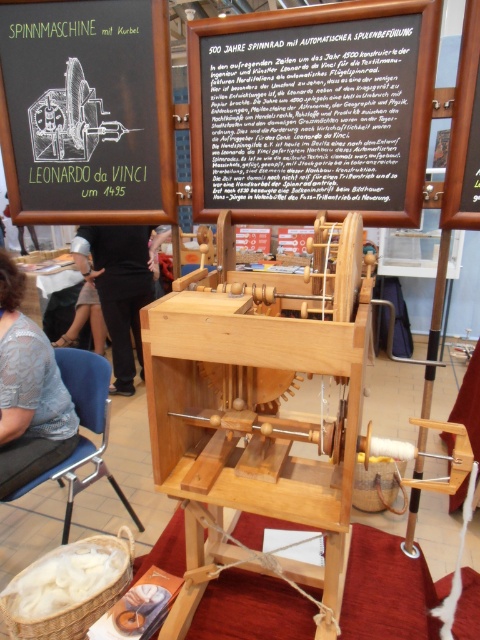
Question: In this image, where is wooden frame at center located relative to blue fabric chair at lower left?

Choices:
 (A) above
 (B) below

Answer: (A)

Question: Which point is closer to the camera taking this photo?

Choices:
 (A) coord(61,394)
 (B) coord(384,20)
 (C) coord(115,289)

Answer: (B)

Question: Is black fabric at center to the right of green chalkboard at upper left from the viewer's perspective?

Choices:
 (A) yes
 (B) no

Answer: (B)

Question: Which is nearer to the black chalkboard at upper left?

Choices:
 (A) wooden frame at center
 (B) black fabric at center
 (C) wooden signboard at center
 (D) green chalkboard at upper left

Answer: (D)

Question: Can you confirm if wooden signboard at center is wider than black chalkboard at upper left?

Choices:
 (A) no
 (B) yes

Answer: (B)

Question: Which object appears farthest from the camera in this image?

Choices:
 (A) black chalkboard at upper left
 (B) blue fabric chair at lower left
 (C) lace fabric at lower left

Answer: (B)